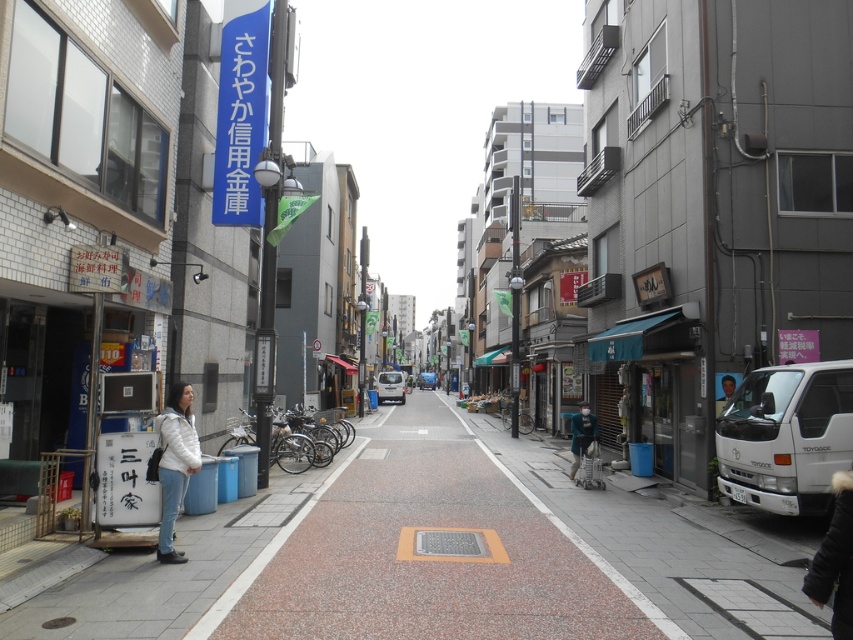
You are a delivery person standing at the entrance of the shop with the blue signboard. You need to place a package on the blue fabric awning at lower right and then move the metallic silver bicycles at center to make space. Which object should you move first to access the awning?

You should move the metallic silver bicycles at center first because the blue fabric awning at lower right is closer to the viewer than the bicycles, so accessing the awning requires moving the bicycles out of the way first.

You are a delivery person with a cart that is 2 meters wide. You need to navigate through the narrow urban street depicted in the image. The blue fabric awning at lower right and the white matte jacket at lower left are present in the scene. Can your cart pass between these two objects without touching them?

The distance between the blue fabric awning at lower right and the white matte jacket at lower left is 8.93 meters. Since your cart is only 2 meters wide, there is sufficient space for it to pass through without touching either object.